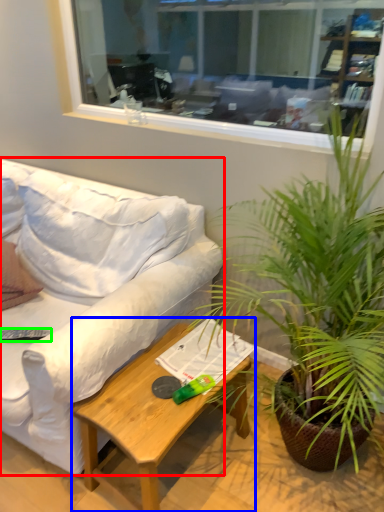
Question: Which object is the closest to the studio couch (highlighted by a red box)? Choose among these: coffee table (highlighted by a blue box) or remote control (highlighted by a green box).

Choices:
 (A) coffee table
 (B) remote control

Answer: (A)